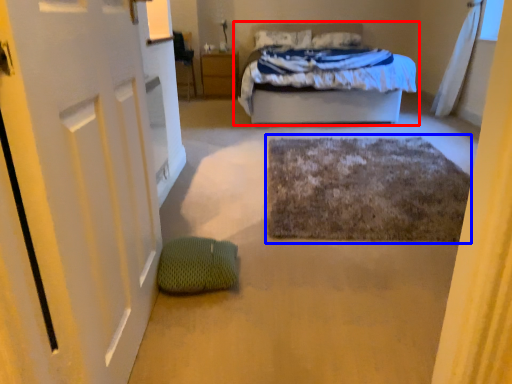
Question: Which object is further to the camera taking this photo, bed (highlighted by a red box) or bath mat (highlighted by a blue box)?

Choices:
 (A) bed
 (B) bath mat

Answer: (A)